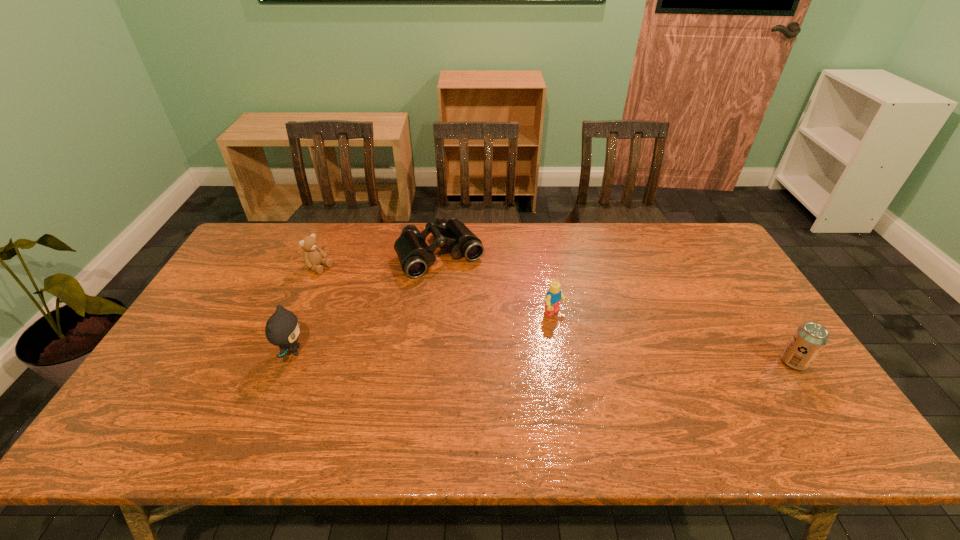
Where is `kitten`? The width and height of the screenshot is (960, 540). kitten is located at coordinates (282, 329).

This screenshot has width=960, height=540. I want to click on the rightmost object, so click(809, 339).

The height and width of the screenshot is (540, 960). Identify the location of binoculars. (414, 254).

Find the location of a particular element. The width and height of the screenshot is (960, 540). Lego is located at coordinates tap(553, 297).

At what (x,y) coordinates should I click in order to perform the action: click on the fourth object from left to right. Please return your answer as a coordinate pair (x, y). Looking at the image, I should click on (553, 297).

Find the location of a particular element. This screenshot has width=960, height=540. teddy bear is located at coordinates (313, 256).

You are a GUI agent. You are given a task and a screenshot of the screen. Output one action in this format:
    pyautogui.click(x=<x>, y=<y>)
    Task: Click on the free space located on the front-facing side of the kitten
    
    Given the screenshot: What is the action you would take?
    pyautogui.click(x=360, y=352)

Where is `blank space located on the back of the rightmost object`? Image resolution: width=960 pixels, height=540 pixels. blank space located on the back of the rightmost object is located at coordinates (746, 291).

You are a GUI agent. You are given a task and a screenshot of the screen. Output one action in this format:
    pyautogui.click(x=<x>, y=<y>)
    Task: Click on the vacant area located on the front-facing side of the binoculars
    This screenshot has width=960, height=540.
    Given the screenshot: What is the action you would take?
    pyautogui.click(x=519, y=369)

Where is `vacant space situated 0.300m on the front-facing side of the binoculars`? vacant space situated 0.300m on the front-facing side of the binoculars is located at coordinates (502, 345).